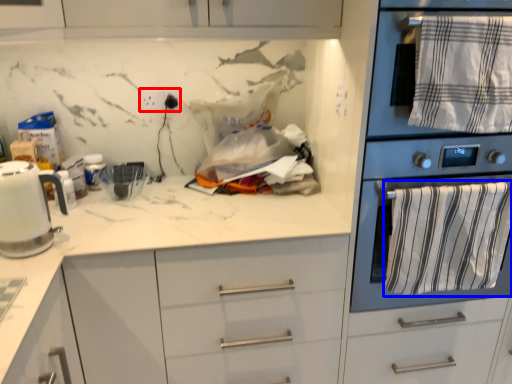
Question: Among these objects, which one is nearest to the camera, electric outlet (highlighted by a red box) or bath towel (highlighted by a blue box)?

Choices:
 (A) electric outlet
 (B) bath towel

Answer: (B)